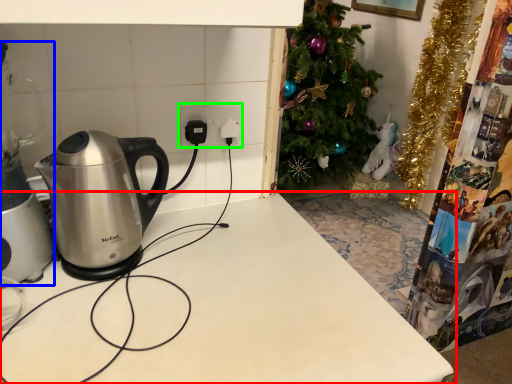
Question: Estimate the real-world distances between objects in this image. Which object is closer to table (highlighted by a red box), appliance (highlighted by a blue box) or electric outlet (highlighted by a green box)?

Choices:
 (A) appliance
 (B) electric outlet

Answer: (A)